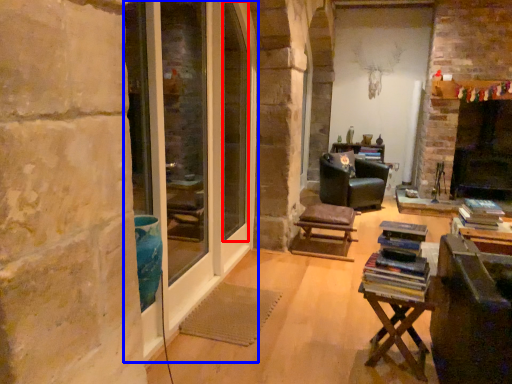
Question: Among these objects, which one is nearest to the camera, window screen (highlighted by a red box) or screen door (highlighted by a blue box)?

Choices:
 (A) window screen
 (B) screen door

Answer: (B)